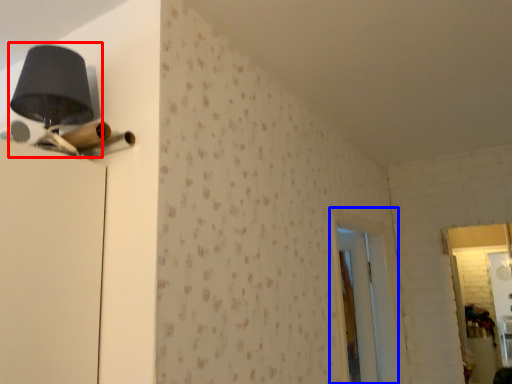
Question: Among these objects, which one is nearest to the camera, table lamp (highlighted by a red box) or screen door (highlighted by a blue box)?

Choices:
 (A) table lamp
 (B) screen door

Answer: (A)